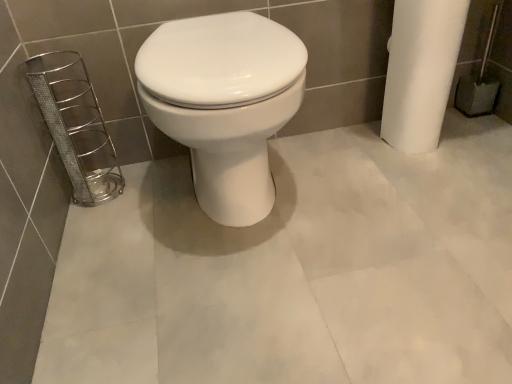
I want to click on vacant area that is in front of white glossy toilet at center, so click(246, 306).